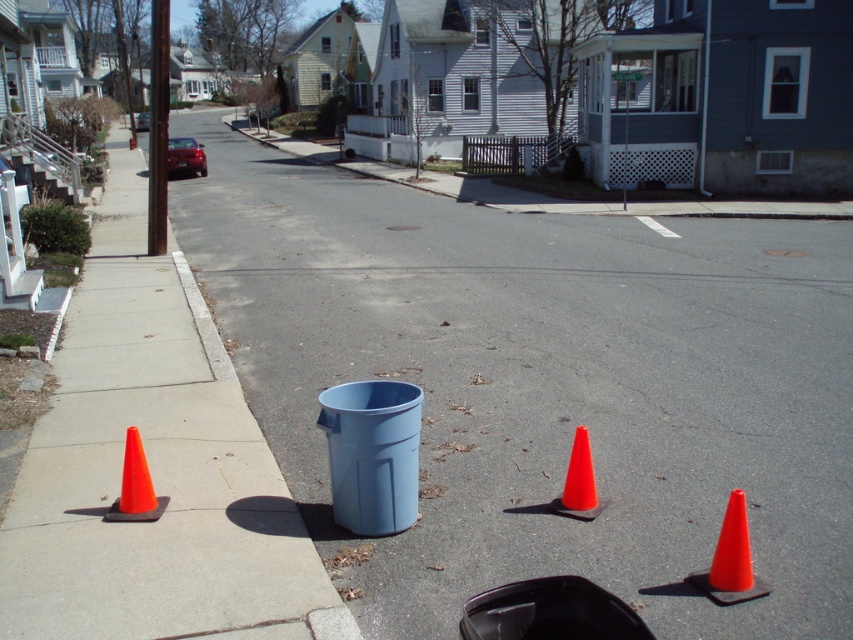
Question: Where is orange matte traffic cone at lower left located in relation to orange matte traffic cone at center in the image?

Choices:
 (A) right
 (B) left

Answer: (B)

Question: Which of the following is the closest to the observer?

Choices:
 (A) orange plastic traffic cone at lower right
 (B) orange matte traffic cone at lower left

Answer: (A)

Question: Which object is positioned closest to the orange matte traffic cone at lower left?

Choices:
 (A) orange matte traffic cone at center
 (B) orange plastic traffic cone at lower right
 (C) orange plastic cones at left
 (D) orange plastic cone at left

Answer: (D)

Question: Observing the image, what is the correct spatial positioning of orange plastic cone at left in reference to orange matte traffic cone at lower left?

Choices:
 (A) left
 (B) right

Answer: (A)

Question: Does orange plastic cone at left appear on the left side of orange matte traffic cone at center?

Choices:
 (A) no
 (B) yes

Answer: (B)

Question: Which of the following is the farthest from the observer?

Choices:
 (A) (508, 364)
 (B) (126, 440)
 (C) (579, 442)
 (D) (22, 588)

Answer: (A)